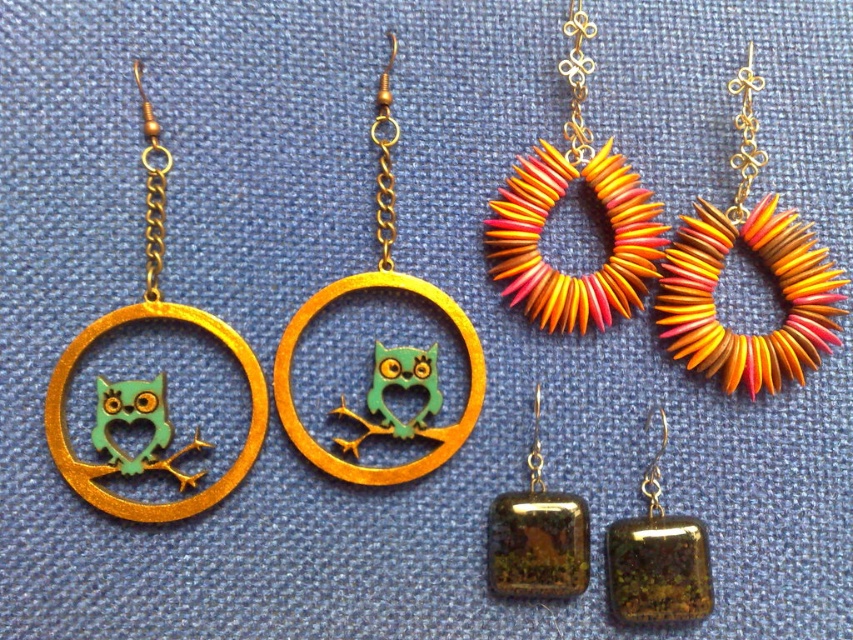
From the picture: Does gold textured square at bottom right have a greater width compared to green matte owl at left?

Indeed, gold textured square at bottom right has a greater width compared to green matte owl at left.

You are a GUI agent. You are given a task and a screenshot of the screen. Output one action in this format:
    pyautogui.click(x=<x>, y=<y>)
    Task: Click on the gold textured square at bottom right
    
    Given the screenshot: What is the action you would take?
    [657, 561]

Which is below, multicolored wooden beads at upper right or gold metallic owl at center?

Positioned lower is gold metallic owl at center.

Is point (720, 234) closer to camera compared to point (387, 131)?

That is True.

Locate an element on the screen. multicolored wooden beads at upper right is located at coordinates [x=764, y=268].

Who is more distant from viewer, (808,227) or (540,477)?

Positioned behind is point (540,477).

Which of these two, multicolored wooden beads at upper right or gold textured square at lower right, stands taller?

multicolored wooden beads at upper right is taller.

Which is behind, point (834, 284) or point (549, 572)?

The point (834, 284) is more distant.

Where is `multicolored wooden beads at upper right`? This screenshot has height=640, width=853. multicolored wooden beads at upper right is located at coordinates (764, 268).